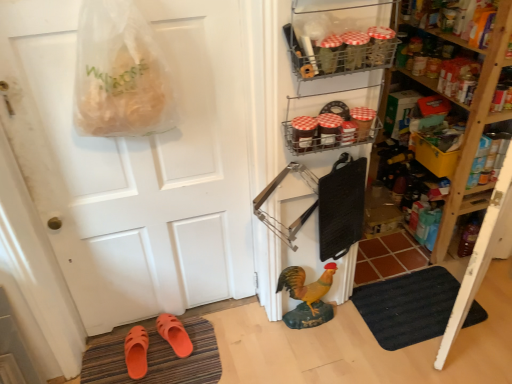
You are a GUI agent. You are given a task and a screenshot of the screen. Output one action in this format:
    pyautogui.click(x=<x>, y=<y>)
    Task: Click on the free area in between painted wood rooster at lower center and orange rubber doormat at lower left, positioned as the second doormat in right-to-left order
    
    Given the screenshot: What is the action you would take?
    pyautogui.click(x=247, y=340)